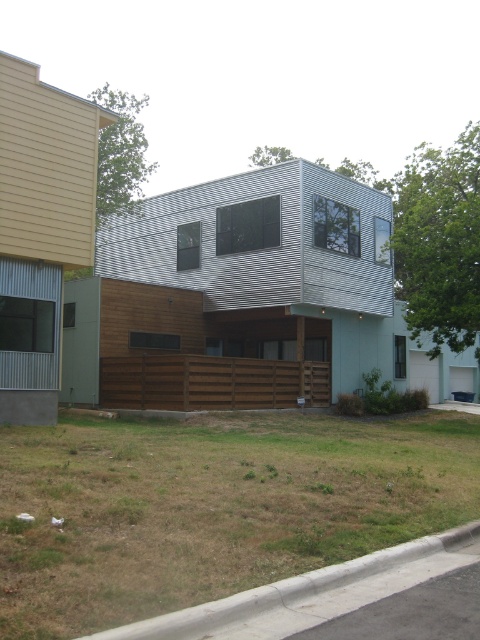
Question: Is brown dry grass at lower center thinner than gray concrete curb at lower right?

Choices:
 (A) yes
 (B) no

Answer: (B)

Question: Which point is farther to the camera?

Choices:
 (A) (360, 573)
 (B) (180, 465)

Answer: (B)

Question: Which object is closer to the camera taking this photo?

Choices:
 (A) gray concrete curb at lower right
 (B) brown dry grass at lower center

Answer: (A)

Question: Is brown dry grass at lower center in front of gray concrete curb at lower right?

Choices:
 (A) yes
 (B) no

Answer: (B)

Question: Is brown dry grass at lower center below gray concrete curb at lower right?

Choices:
 (A) no
 (B) yes

Answer: (B)